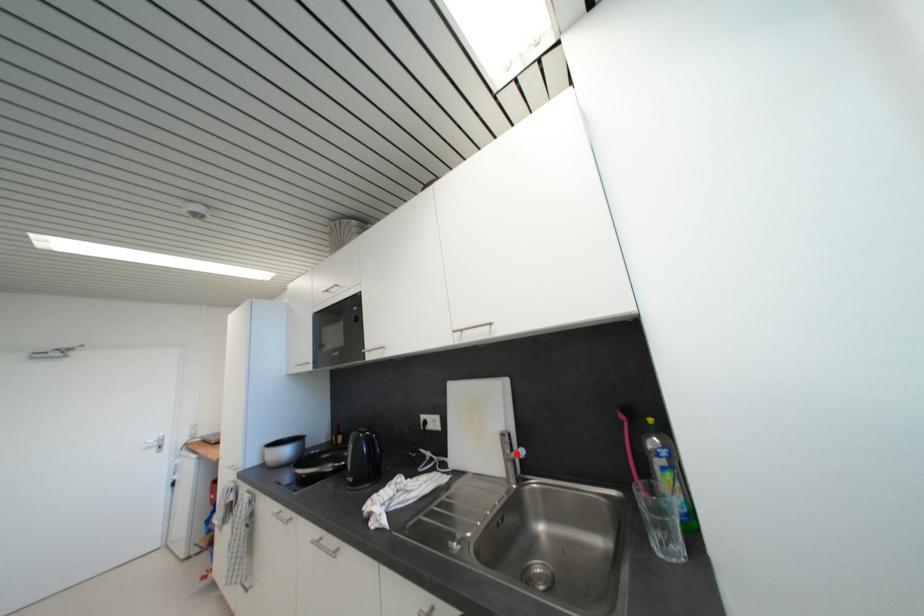
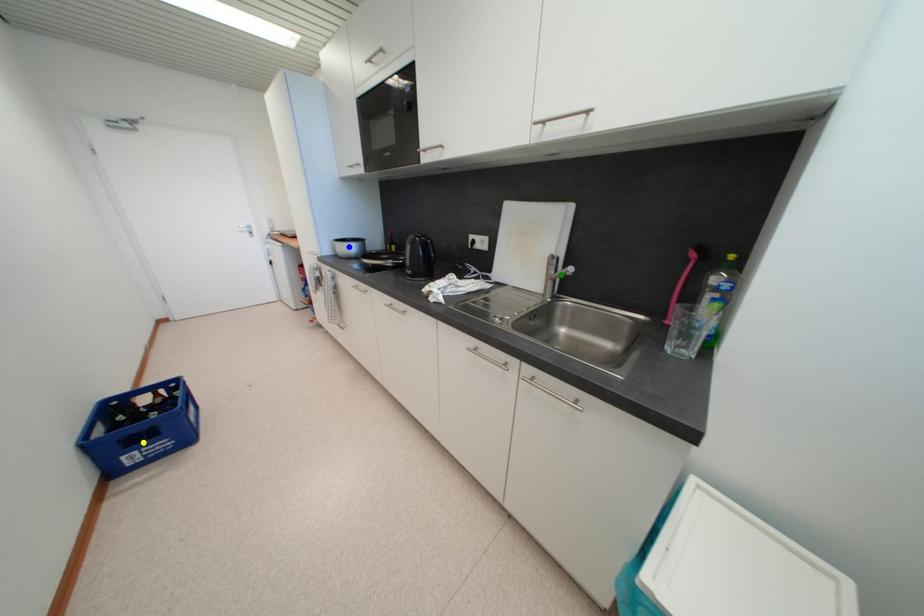
Question: I am providing you with two images of the same scene from different viewpoints. A red point is marked on the first image. You are given multiple points on the second image. Which spot in image 2 lines up with the point in image 1?

Choices:
 (A) green point
 (B) blue point
 (C) yellow point

Answer: (A)